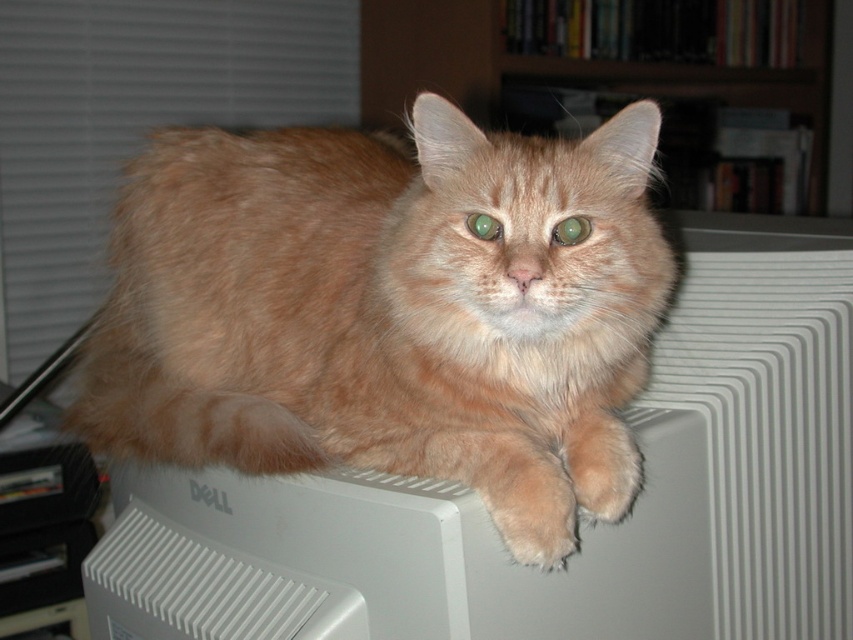
You are an interior designer assessing the placement of furniture in a home office. You see the fuzzy orange cat at center and the wooden bookshelf at upper center. Which object is positioned higher in the image?

The wooden bookshelf at upper center is positioned higher in the image than the fuzzy orange cat at center.

You are organizing a home office and need to place a new desk between the fuzzy orange cat at center and the wooden bookshelf at upper center. Based on their current positions, which side of the bookshelf should the desk be placed to avoid blocking the cat?

The desk should be placed on the right side of the wooden bookshelf at upper center since the fuzzy orange cat at center is on the left side of the bookshelf, so placing the desk on the right would avoid blocking the cat.